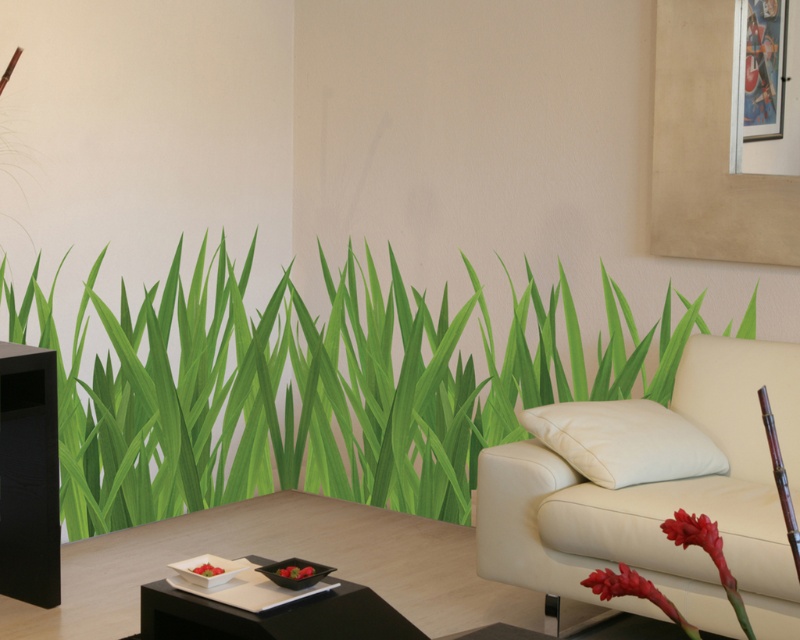
Question: Among these objects, which one is farthest from the camera?

Choices:
 (A) green matte grass at center
 (B) black glossy side table at lower center

Answer: (A)

Question: Is green matte grass at center closer to camera compared to white leather couch at upper right?

Choices:
 (A) no
 (B) yes

Answer: (A)

Question: Is green matte grass at center to the left of white leather couch at upper right from the viewer's perspective?

Choices:
 (A) no
 (B) yes

Answer: (B)

Question: Which point is farther to the camera?

Choices:
 (A) (206, 301)
 (B) (705, 506)

Answer: (A)

Question: Does green matte grass at center have a larger size compared to black glossy side table at lower center?

Choices:
 (A) no
 (B) yes

Answer: (B)

Question: Estimate the real-world distances between objects in this image. Which object is farther from the white leather couch at upper right?

Choices:
 (A) green matte grass at center
 (B) black glossy side table at lower center

Answer: (A)